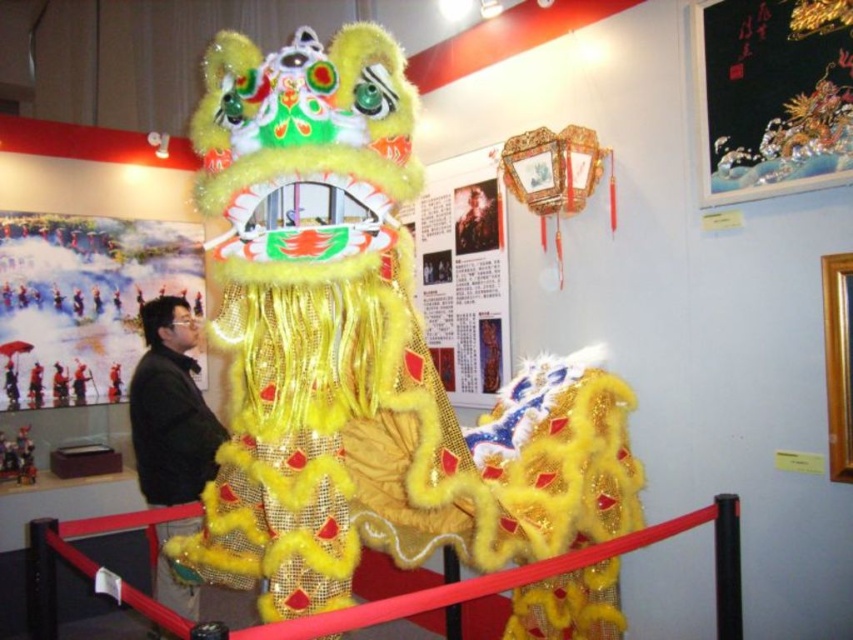
Question: From the image, what is the correct spatial relationship of rubberized plastic barrier at center in relation to matte paper poster at center?

Choices:
 (A) left
 (B) right

Answer: (A)

Question: Does matte paper poster at upper left have a smaller size compared to black fabric jacket at center?

Choices:
 (A) no
 (B) yes

Answer: (A)

Question: Estimate the real-world distances between objects in this image. Which object is farther from the matte paper poster at upper left?

Choices:
 (A) metallic silver armor at upper center
 (B) rubberized plastic barrier at center

Answer: (B)

Question: Does black silk scroll at upper right appear under rubberized plastic barrier at center?

Choices:
 (A) yes
 (B) no

Answer: (B)

Question: Considering the real-world distances, which object is farthest from the black silk scroll at upper right?

Choices:
 (A) black fabric jacket at center
 (B) matte paper poster at center
 (C) matte paper poster at upper left
 (D) metallic silver armor at upper center

Answer: (C)

Question: Which point is farther from the camera taking this photo?

Choices:
 (A) (167, 497)
 (B) (793, 13)

Answer: (A)